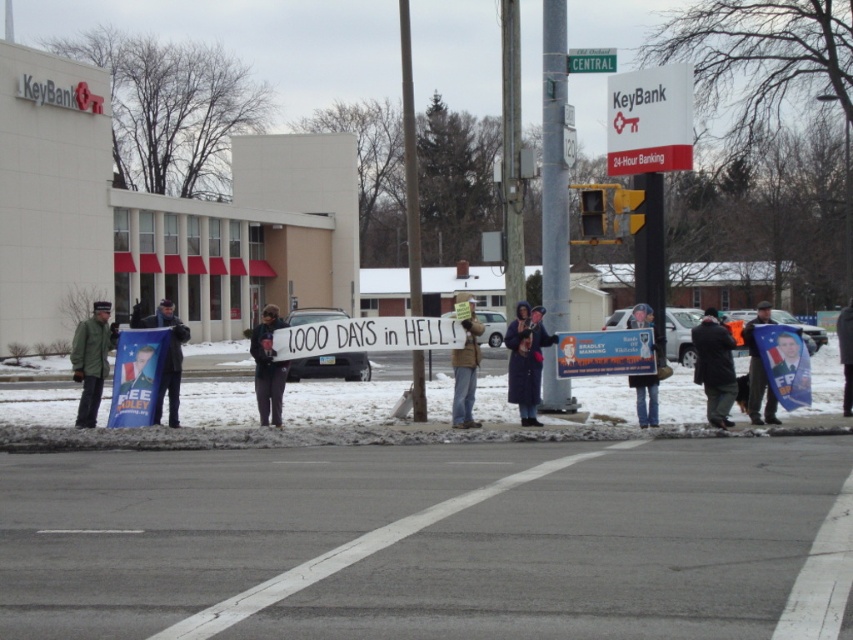
Question: Which point is closer to the camera?

Choices:
 (A) (639, 323)
 (B) (409, 227)

Answer: (A)

Question: Considering the relative positions of metallic silver poster at center and green wool jacket at left in the image provided, where is metallic silver poster at center located with respect to green wool jacket at left?

Choices:
 (A) above
 (B) below

Answer: (B)

Question: Can you confirm if white paper sign at center is positioned to the left of gray wool coat at lower right?

Choices:
 (A) no
 (B) yes

Answer: (B)

Question: Can you confirm if dark gray fabric jacket at lower right is positioned below green wool jacket at left?

Choices:
 (A) yes
 (B) no

Answer: (A)

Question: Among these points, which one is nearest to the camera?

Choices:
 (A) (83, 324)
 (B) (412, 381)
 (C) (521, 321)
 (D) (561, 22)

Answer: (A)

Question: Among these objects, which one is nearest to the camera?

Choices:
 (A) smooth gray pole at center
 (B) brown paper bag at center
 (C) white plastic sign at upper right
 (D) dark gray fabric sign at center

Answer: (B)